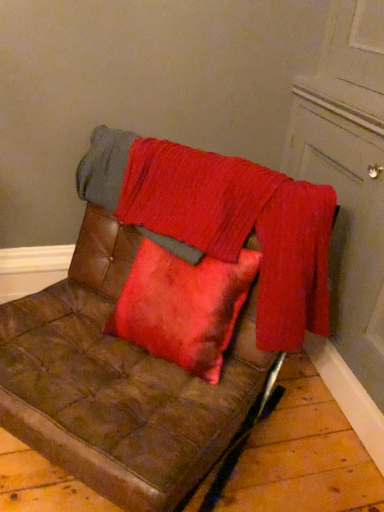
Question: Considering the relative positions of velvet red blanket at center and matte white door at upper right in the image provided, is velvet red blanket at center to the left of matte white door at upper right from the viewer's perspective?

Choices:
 (A) yes
 (B) no

Answer: (A)

Question: Is velvet red blanket at center not inside matte white door at upper right?

Choices:
 (A) yes
 (B) no

Answer: (A)

Question: From the image's perspective, is velvet red blanket at center beneath matte white door at upper right?

Choices:
 (A) no
 (B) yes

Answer: (B)

Question: Would you say velvet red blanket at center is a long distance from matte white door at upper right?

Choices:
 (A) no
 (B) yes

Answer: (A)

Question: Is matte white door at upper right a part of velvet red blanket at center?

Choices:
 (A) no
 (B) yes

Answer: (A)

Question: Is velvet red blanket at center looking in the opposite direction of matte white door at upper right?

Choices:
 (A) no
 (B) yes

Answer: (B)

Question: From the image's perspective, is velvet red blanket at center above brown leather couch at center?

Choices:
 (A) yes
 (B) no

Answer: (A)

Question: Is velvet red blanket at center far from brown leather couch at center?

Choices:
 (A) yes
 (B) no

Answer: (B)

Question: Does velvet red blanket at center have a greater height compared to brown leather couch at center?

Choices:
 (A) yes
 (B) no

Answer: (B)

Question: From a real-world perspective, is velvet red blanket at center on brown leather couch at center?

Choices:
 (A) yes
 (B) no

Answer: (A)

Question: Is velvet red blanket at center not inside brown leather couch at center?

Choices:
 (A) yes
 (B) no

Answer: (B)

Question: Does velvet red blanket at center have a lesser height compared to brown leather couch at center?

Choices:
 (A) no
 (B) yes

Answer: (B)

Question: Does brown leather couch at center have a lesser height compared to matte white door at upper right?

Choices:
 (A) yes
 (B) no

Answer: (A)